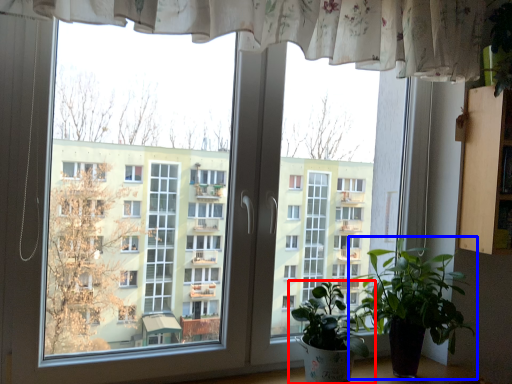
Question: Which of the following is the closest to the observer, houseplant (highlighted by a red box) or houseplant (highlighted by a blue box)?

Choices:
 (A) houseplant
 (B) houseplant

Answer: (A)